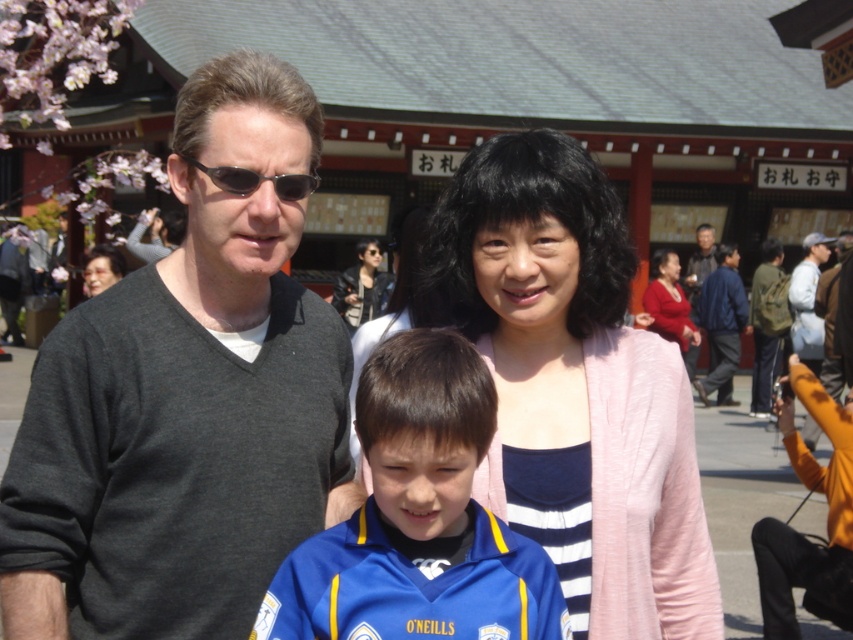
Question: Can you confirm if dark gray sweater at left is thinner than pink fabric at center?

Choices:
 (A) no
 (B) yes

Answer: (B)

Question: Is pink fabric at center below black plastic sunglasses at upper center?

Choices:
 (A) no
 (B) yes

Answer: (B)

Question: Is the position of dark gray sweater at left more distant than that of blue jersey at center?

Choices:
 (A) yes
 (B) no

Answer: (A)

Question: Which of the following is the farthest from the observer?

Choices:
 (A) (352, 316)
 (B) (544, 134)
 (C) (113, 337)

Answer: (A)

Question: Which point is closer to the camera?

Choices:
 (A) (810, 346)
 (B) (102, 253)
 (C) (662, 300)

Answer: (B)

Question: Which of the following is the farthest from the observer?

Choices:
 (A) blue jersey at center
 (B) light gray jacket at right

Answer: (B)